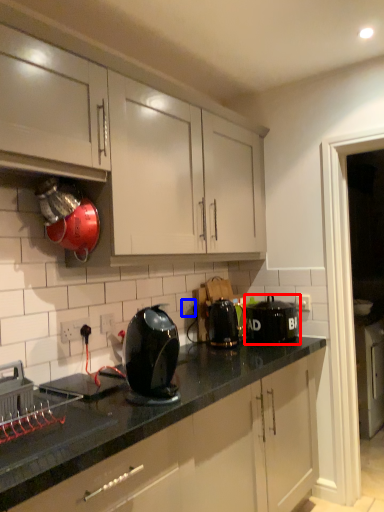
Question: Among these objects, which one is farthest to the camera, kitchen appliance (highlighted by a red box) or electric outlet (highlighted by a blue box)?

Choices:
 (A) kitchen appliance
 (B) electric outlet

Answer: (B)